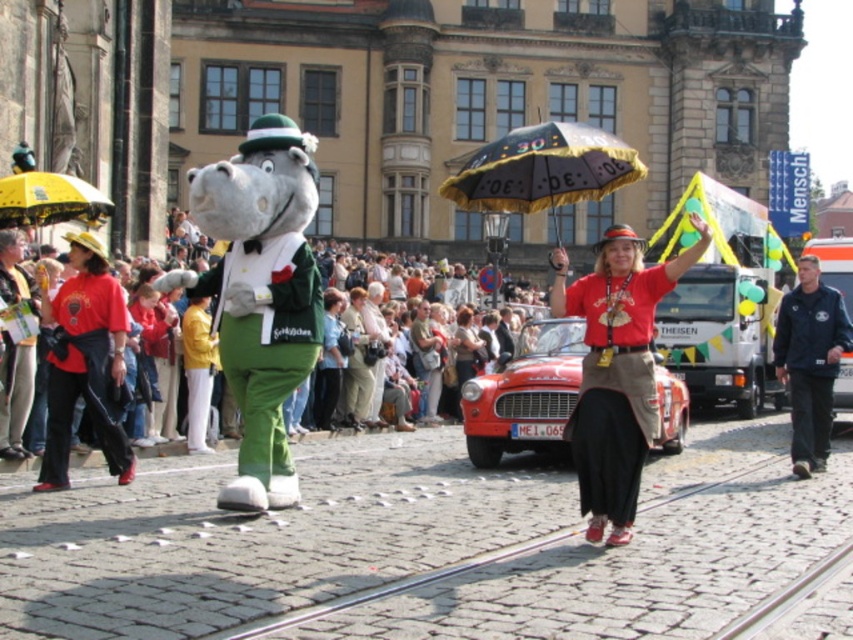
Does red cotton shirt at center come behind black satin umbrella at center?

No, it is in front of black satin umbrella at center.

Between point (595, 456) and point (531, 179), which one is positioned in front?

Point (595, 456) is in front.

Between point (602, 429) and point (490, 236), which one is positioned in front?

Point (602, 429) is more forward.

Where is `red cotton shirt at center`? The height and width of the screenshot is (640, 853). red cotton shirt at center is located at coordinates (614, 372).

Find the location of a particular element. dark blue uniform at right is located at coordinates (810, 362).

Does dark blue uniform at right appear on the left side of yellow fabric umbrella at upper left?

No, dark blue uniform at right is not to the left of yellow fabric umbrella at upper left.

Between point (808, 284) and point (4, 188), which one is positioned in front?

Point (4, 188) is in front.

Find the location of a particular element. dark blue uniform at right is located at coordinates (810, 362).

Between red cotton shirt at center and dark blue uniform at right, which one appears on the left side from the viewer's perspective?

red cotton shirt at center

Can you confirm if red cotton shirt at center is shorter than dark blue uniform at right?

Incorrect, red cotton shirt at center's height does not fall short of dark blue uniform at right's.

Who is more forward, (x=647, y=413) or (x=785, y=369)?

Positioned in front is point (x=647, y=413).

The height and width of the screenshot is (640, 853). Identify the location of red cotton shirt at center. (614, 372).